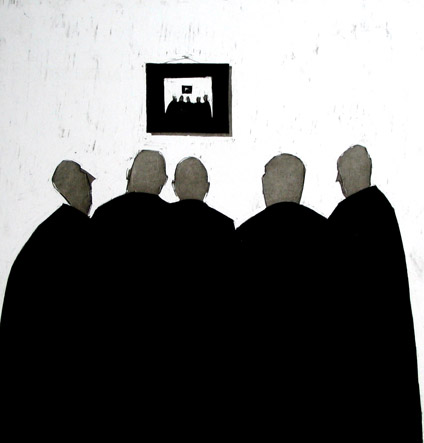
The height and width of the screenshot is (443, 424). What are the coordinates of `wall` in the screenshot? It's located at (279, 30).